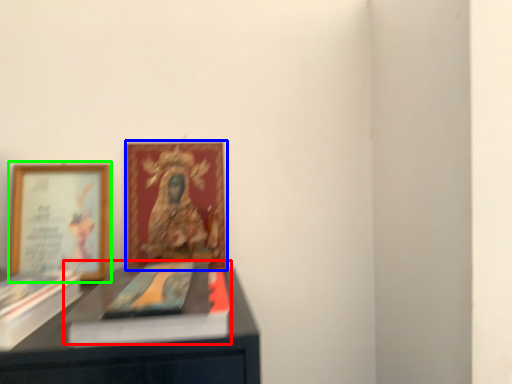
Question: Which object is the farthest from book cover (highlighted by a red box)? Choose among these: picture frame (highlighted by a blue box) or picture frame (highlighted by a green box).

Choices:
 (A) picture frame
 (B) picture frame

Answer: (B)